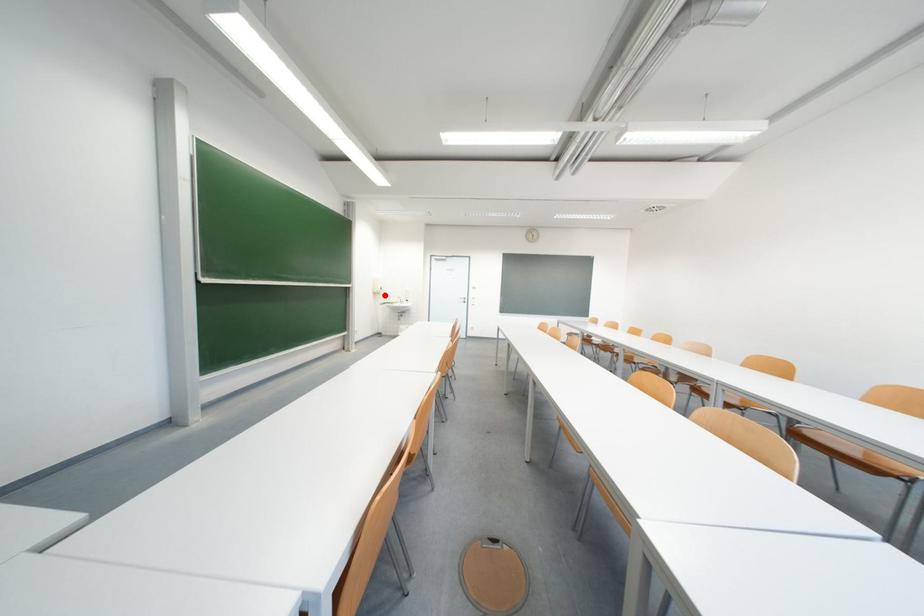
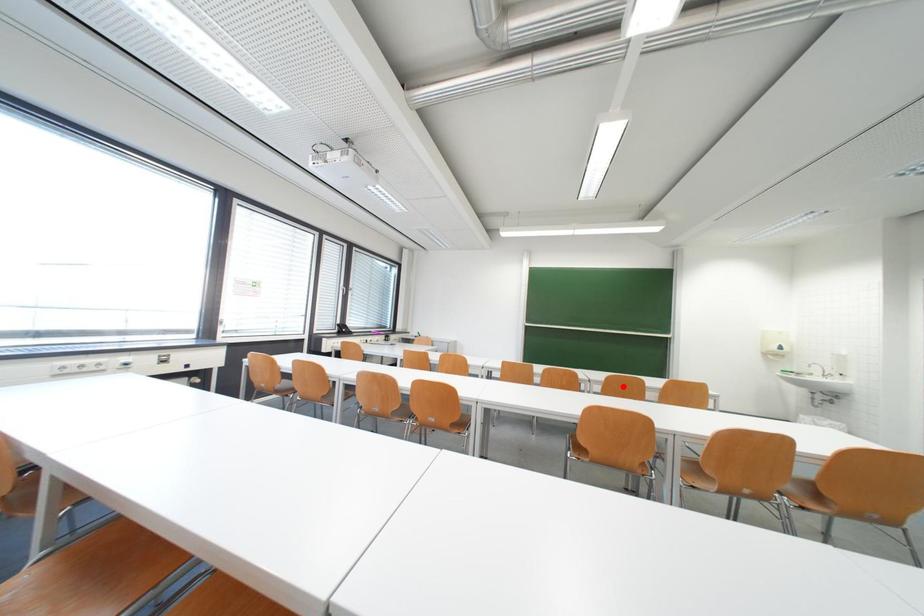
I am providing you with two images of the same scene from different viewpoints. A red point is marked on the first image and another point is marked on the second image. Is the red point in image1 aligned with the point shown in image2?

No